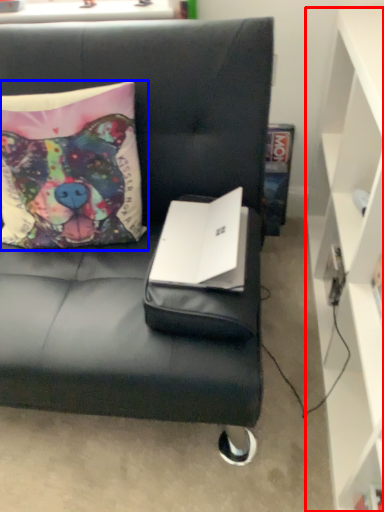
Question: Which object appears farthest to the camera in this image, cabinetry (highlighted by a red box) or pillow (highlighted by a blue box)?

Choices:
 (A) cabinetry
 (B) pillow

Answer: (B)